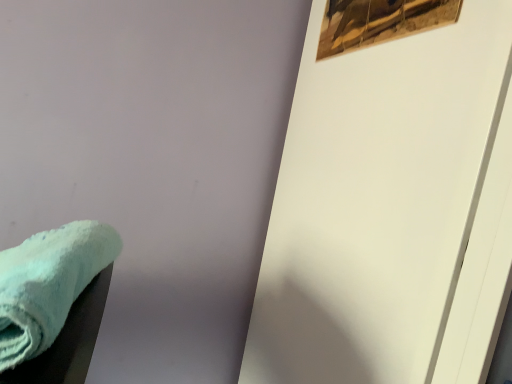
Identify the location of wooden frame at upper right. (379, 22).

What is the approximate width of wooden frame at upper right?

wooden frame at upper right is 0.50 inches wide.

Describe the element at coordinates (379, 22) in the screenshot. I see `wooden frame at upper right` at that location.

What do you see at coordinates (48, 284) in the screenshot? I see `soft teal towel at lower left` at bounding box center [48, 284].

Where is `soft teal towel at lower left`? soft teal towel at lower left is located at coordinates (48, 284).

The width and height of the screenshot is (512, 384). In order to click on wooden frame at upper right in this screenshot , I will do `click(379, 22)`.

Which object is positioned more to the right, soft teal towel at lower left or wooden frame at upper right?

wooden frame at upper right.

Which object is more forward, soft teal towel at lower left or wooden frame at upper right?

soft teal towel at lower left is closer to the camera.

Does point (89, 237) lie in front of point (361, 37)?

Yes.

From the image's perspective, does soft teal towel at lower left appear lower than wooden frame at upper right?

Yes.

From a real-world perspective, is soft teal towel at lower left physically above wooden frame at upper right?

No, from a real-world perspective, soft teal towel at lower left is not over wooden frame at upper right

Considering the sizes of objects soft teal towel at lower left and wooden frame at upper right in the image provided, who is thinner, soft teal towel at lower left or wooden frame at upper right?

With smaller width is wooden frame at upper right.

From their relative heights in the image, would you say soft teal towel at lower left is taller or shorter than wooden frame at upper right?

In the image, soft teal towel at lower left appears to be taller than wooden frame at upper right.

Is soft teal towel at lower left bigger than wooden frame at upper right?

Correct, soft teal towel at lower left is larger in size than wooden frame at upper right.

Is soft teal towel at lower left not within wooden frame at upper right?

Indeed, soft teal towel at lower left is completely outside wooden frame at upper right.

Can you see soft teal towel at lower left touching wooden frame at upper right?

No, soft teal towel at lower left is not next to wooden frame at upper right.

Does soft teal towel at lower left turn towards wooden frame at upper right?

No, soft teal towel at lower left does not turn towards wooden frame at upper right.

In order to click on picture frame above the soft teal towel at lower left (from the image's perspective) in this screenshot , I will do `click(379, 22)`.

Based on the photo, considering the positions of objects wooden frame at upper right and soft teal towel at lower left in the image provided, who is more to the right, wooden frame at upper right or soft teal towel at lower left?

wooden frame at upper right.

Considering the relative positions of wooden frame at upper right and soft teal towel at lower left in the image provided, is wooden frame at upper right in front of soft teal towel at lower left?

No.

Is point (383, 32) farther from camera compared to point (16, 363)?

Yes, it is.

From the image's perspective, which one is positioned higher, wooden frame at upper right or soft teal towel at lower left?

wooden frame at upper right.

From a real-world perspective, relative to soft teal towel at lower left, is wooden frame at upper right vertically above or below?

In terms of real-world spatial position, wooden frame at upper right is above soft teal towel at lower left.

Considering the relative sizes of wooden frame at upper right and soft teal towel at lower left in the image provided, is wooden frame at upper right wider than soft teal towel at lower left?

Incorrect, the width of wooden frame at upper right does not surpass that of soft teal towel at lower left.

Considering the sizes of wooden frame at upper right and soft teal towel at lower left in the image, is wooden frame at upper right taller or shorter than soft teal towel at lower left?

Clearly, wooden frame at upper right is shorter compared to soft teal towel at lower left.

Does wooden frame at upper right have a larger size compared to soft teal towel at lower left?

No, wooden frame at upper right is not bigger than soft teal towel at lower left.

Is wooden frame at upper right completely or partially outside of soft teal towel at lower left?

Yes, wooden frame at upper right is located beyond the bounds of soft teal towel at lower left.

Is wooden frame at upper right beside soft teal towel at lower left?

No, wooden frame at upper right is not making contact with soft teal towel at lower left.

Could you tell me if wooden frame at upper right is facing soft teal towel at lower left?

No, wooden frame at upper right is not facing towards soft teal towel at lower left.

How far apart are wooden frame at upper right and soft teal towel at lower left?

wooden frame at upper right and soft teal towel at lower left are 20.74 inches apart from each other.

This screenshot has height=384, width=512. I want to click on picture frame that appears above the soft teal towel at lower left (from the image's perspective), so click(379, 22).

Locate an element on the screen. The image size is (512, 384). towel directly beneath the wooden frame at upper right (from a real-world perspective) is located at coordinates (48, 284).

At what (x,y) coordinates should I click in order to perform the action: click on picture frame that is on the right side of soft teal towel at lower left. Please return your answer as a coordinate pair (x, y). Image resolution: width=512 pixels, height=384 pixels. Looking at the image, I should click on (379, 22).